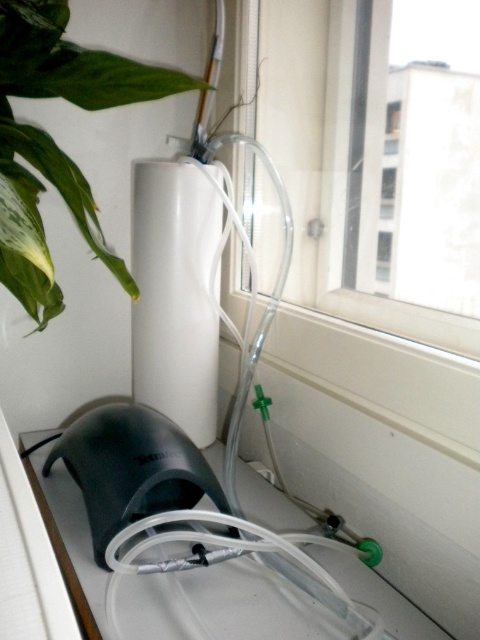
Question: Does transparent glass window at upper right appear on the right side of black matte mouse at lower left?

Choices:
 (A) yes
 (B) no

Answer: (A)

Question: In this image, where is transparent glass window at upper right located relative to green leafy plant at upper left?

Choices:
 (A) below
 (B) above

Answer: (A)

Question: Is transparent glass window at upper right below green leafy plant at upper left?

Choices:
 (A) no
 (B) yes

Answer: (B)

Question: Which of the following is the closest to the observer?

Choices:
 (A) green leafy plant at upper left
 (B) black matte mouse at lower left
 (C) transparent glass window at upper right

Answer: (A)

Question: Estimate the real-world distances between objects in this image. Which object is closer to the green leafy plant at upper left?

Choices:
 (A) black matte mouse at lower left
 (B) transparent glass window at upper right

Answer: (A)

Question: Which point is closer to the camera?

Choices:
 (A) (166, 419)
 (B) (376, 179)

Answer: (B)